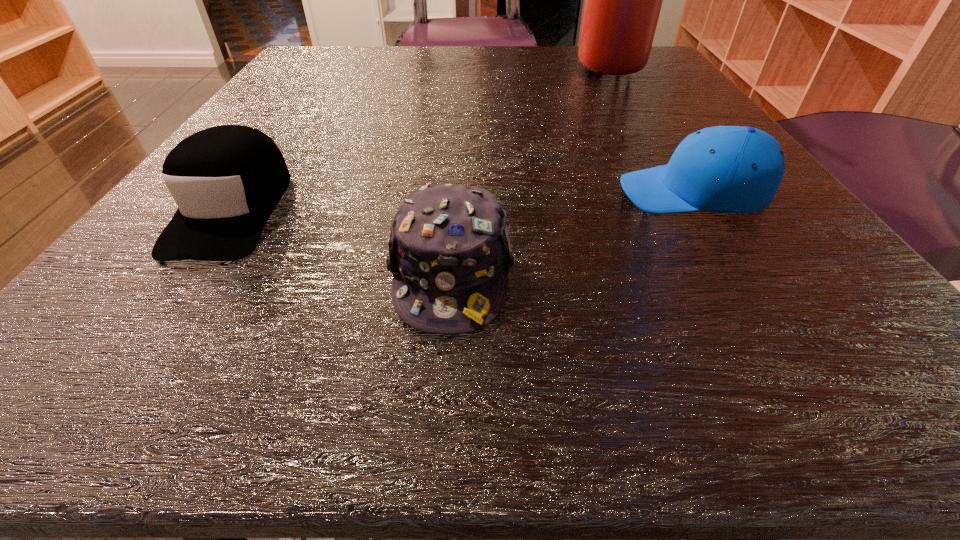
Identify the location of vacant space in between the tallest object and the second headwear from right to left. The image size is (960, 540). (529, 168).

This screenshot has height=540, width=960. Identify the location of empty location between the rightmost headwear and the fire extinguisher. (650, 128).

Identify which object is located as the nearest to the leftmost object. Please provide its 2D coordinates. Your answer should be formatted as a tuple, i.e. [(x, y)], where the tuple contains the x and y coordinates of a point satisfying the conditions above.

[(449, 250)]

Select which object appears as the second closest to the rightmost headwear. Please provide its 2D coordinates. Your answer should be formatted as a tuple, i.e. [(x, y)], where the tuple contains the x and y coordinates of a point satisfying the conditions above.

[(623, 0)]

Choose which headwear is the second nearest neighbor to the second headwear from right to left. Please provide its 2D coordinates. Your answer should be formatted as a tuple, i.e. [(x, y)], where the tuple contains the x and y coordinates of a point satisfying the conditions above.

[(226, 180)]

Where is `the closest headwear to the farthest object`? The image size is (960, 540). the closest headwear to the farthest object is located at coordinates click(726, 169).

Identify the location of vacant region that satisfies the following two spatial constraints: 1. on the instruction side of the fire extinguisher; 2. on the front-facing side of the third object from right to left. The height and width of the screenshot is (540, 960). (731, 273).

What are the coordinates of `free spot that satisfies the following two spatial constraints: 1. on the instruction side of the tallest object; 2. on the front-facing side of the second object from left to right` in the screenshot? It's located at (731, 273).

Image resolution: width=960 pixels, height=540 pixels. I want to click on vacant region that satisfies the following two spatial constraints: 1. on the instruction side of the fire extinguisher; 2. on the front-facing side of the leftmost object, so click(x=693, y=209).

Locate an element on the screen. This screenshot has height=540, width=960. vacant space that satisfies the following two spatial constraints: 1. on the instruction side of the fire extinguisher; 2. on the front-facing side of the leftmost headwear is located at coordinates (693, 209).